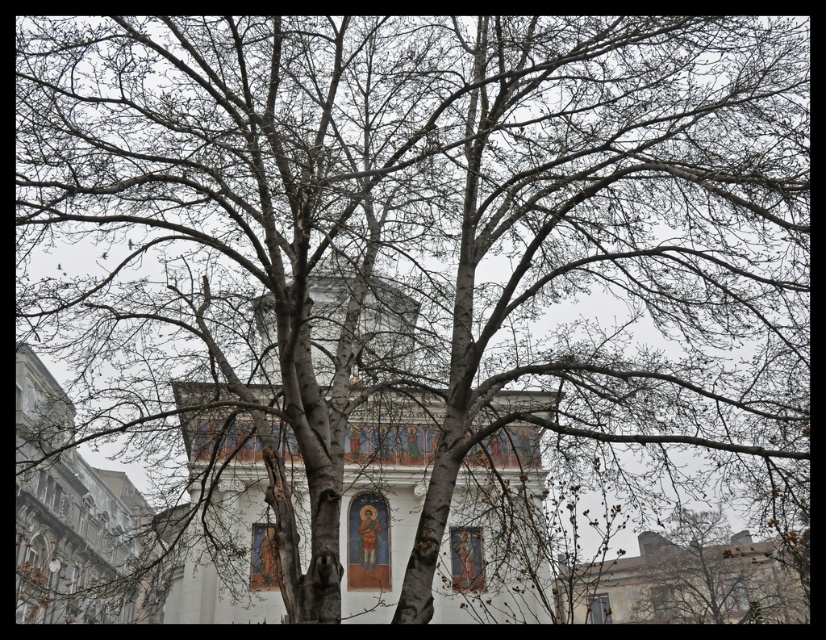
You are standing in a park and see the white painted wood church at center. If you want to take a photo of the church from where you are standing, will the entire church fit in the frame of your camera which has a 50mm lens? Assume the camera sensor size is 36mm x 24mm and the church is 20 meters tall.

The white painted wood church at center is 74.25 meters away from the viewer. Using the lens formula, the angle of view for a 50mm lens on a full frame sensor is approximately 46 degrees vertically. The vertical distance from the camera to the church is 74.25 meters. The maximum height that can be captured is calculated using tan 23 degrees multiplied by 74.25 meters, which is approximately 29.6 meters. Since the church is 20 meters tall, it will fit within the frame.

You are standing in a park and see a large tree with intricate branches and a white building with classical features in the background. You notice a specific point at coordinates point (385, 483). Based on the scene description, can you determine what object this point is located on?

The point (385, 483) is located on the white painted wood church at center.

You are a photographer standing at the base of the large tree in the image. You want to take a photo that includes both the white painted wood church at center and the white stone church at left in the same frame. Given that your camera has a 50mm lens, which has a field of view of approximately 46 degrees, can you capture both churches in a single shot without moving your position?

The white painted wood church at center and the white stone church at left are 22.22 meters apart. With a 50mm lens providing a 46 degree field of view, it would depend on the distance from the photographer to the churches. However, since the exact distance isn not provided, we cannot definitively determine if both can fit in the frame. Additional information about the distance from the photographer to the churches is needed to calculate the required field of view.